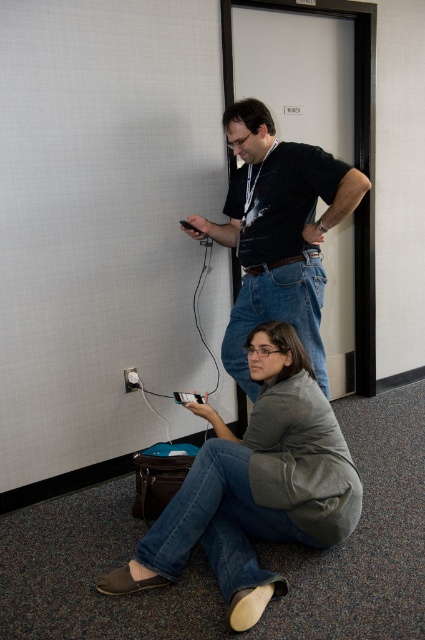
You are standing in the hallway and want to pick up the white plastic plug at lower left without moving the gray cotton shirt at lower center. Is it possible to reach the plug directly from your current position?

The gray cotton shirt at lower center is closer to the viewer than the white plastic plug at lower left, so the plug is further away. Since the shirt is blocking the direct path, you would need to move it to reach the plug.

Based on the photo, you are a delivery person who needs to place a package on the floor near the black matte shirt at center and the white plastic plug at lower left. Which object should you place the package closer to if the package is 10 cm tall?

The package should be placed closer to the white plastic plug at lower left because the black matte shirt at center is taller than the white plastic plug at lower left, so the plug is shorter and the package can fit better near it.